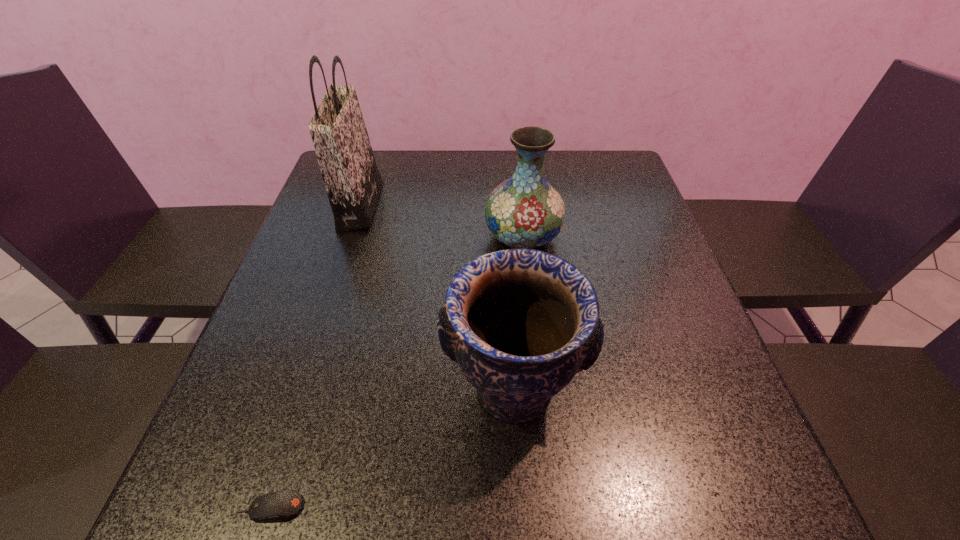
At what (x,y) coordinates should I click in order to perform the action: click on vacant area between the shortest object and the tallest object. Please return your answer as a coordinate pair (x, y). Image resolution: width=960 pixels, height=540 pixels. Looking at the image, I should click on (316, 356).

Where is `vacant space that's between the tallest object and the third farthest object`? vacant space that's between the tallest object and the third farthest object is located at coordinates (437, 298).

The width and height of the screenshot is (960, 540). What are the coordinates of `vacant space in between the nearest object and the pottery` in the screenshot? It's located at (392, 449).

This screenshot has height=540, width=960. Identify the location of vacant point located between the vase and the shortest object. (396, 372).

Locate an element on the screen. The image size is (960, 540). blank region between the vase and the nearest object is located at coordinates pos(396,372).

The height and width of the screenshot is (540, 960). I want to click on the second closest object to the nearest object, so (x=525, y=211).

Choose which object is the third nearest neighbor to the tallest object. Please provide its 2D coordinates. Your answer should be formatted as a tuple, i.e. [(x, y)], where the tuple contains the x and y coordinates of a point satisfying the conditions above.

[(277, 506)]

What are the coordinates of `free space that satisfies the following two spatial constraints: 1. on the back side of the computer mouse; 2. on the front of the tallest object with the design` in the screenshot? It's located at (365, 206).

This screenshot has width=960, height=540. I want to click on free point that satisfies the following two spatial constraints: 1. on the front of the shopping bag with the design; 2. on the back side of the computer mouse, so click(x=263, y=508).

Locate an element on the screen. This screenshot has height=540, width=960. vacant position in the image that satisfies the following two spatial constraints: 1. on the front of the nearest object with the design; 2. on the right side of the tallest object is located at coordinates (x=263, y=508).